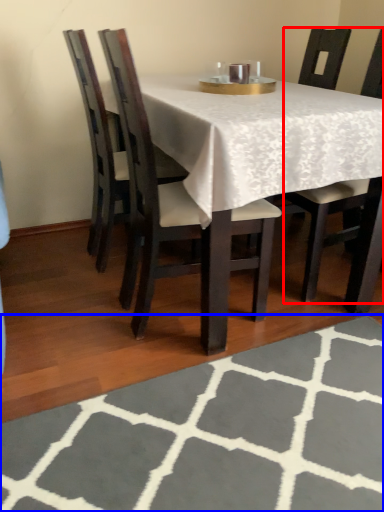
Question: Which of the following is the farthest to the observer, chair (highlighted by a red box) or place mat (highlighted by a blue box)?

Choices:
 (A) chair
 (B) place mat

Answer: (A)